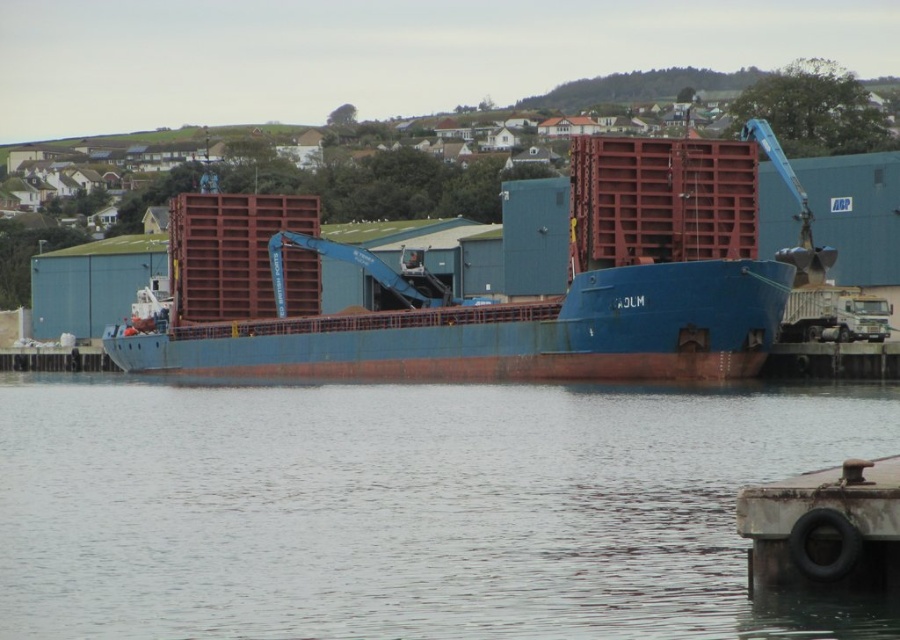
Question: Is transparent water at center below blue matte container ship at center?

Choices:
 (A) yes
 (B) no

Answer: (A)

Question: Is transparent water at center closer to the viewer compared to blue matte container ship at center?

Choices:
 (A) yes
 (B) no

Answer: (A)

Question: Can you confirm if transparent water at center is smaller than blue matte container ship at center?

Choices:
 (A) yes
 (B) no

Answer: (A)

Question: Which object is farther from the camera taking this photo?

Choices:
 (A) blue matte container ship at center
 (B) transparent water at center

Answer: (A)